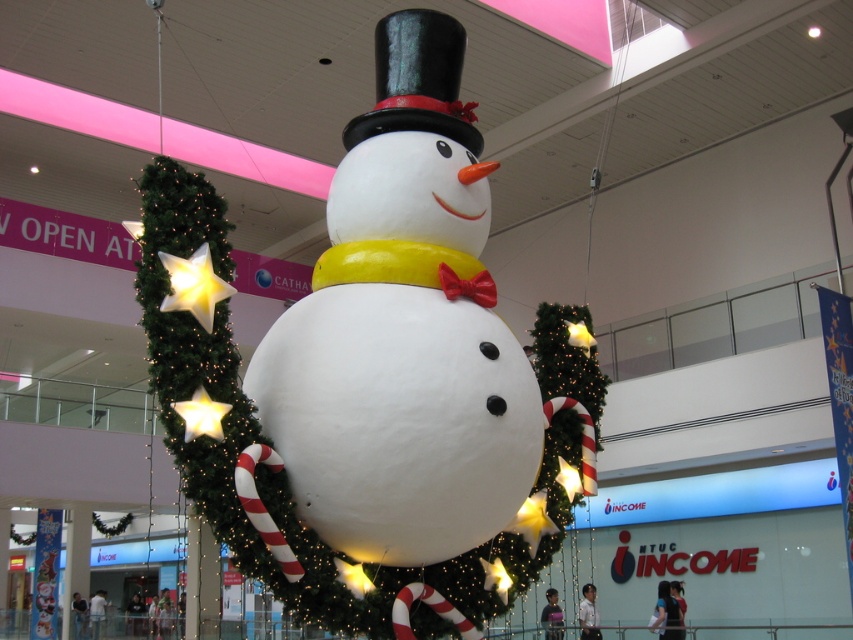
Question: Which object appears closest to the camera in this image?

Choices:
 (A) white matte snowman at center
 (B) shiny black hat at upper center

Answer: (A)

Question: Is white matte snowman at center closer to the viewer compared to shiny black hat at upper center?

Choices:
 (A) no
 (B) yes

Answer: (B)

Question: Among these points, which one is farthest from the camera?

Choices:
 (A) coord(440,112)
 (B) coord(364,118)

Answer: (A)

Question: Does white matte snowman at center lie in front of shiny black hat at upper center?

Choices:
 (A) yes
 (B) no

Answer: (A)

Question: Does white matte snowman at center lie in front of shiny black hat at upper center?

Choices:
 (A) no
 (B) yes

Answer: (B)